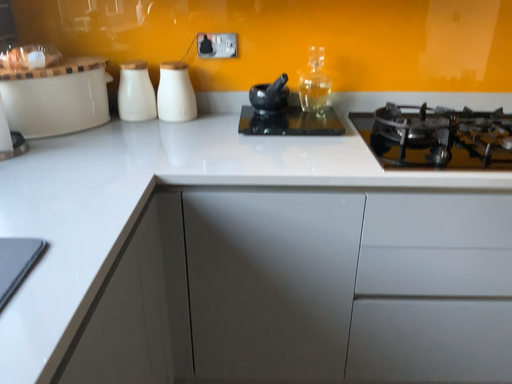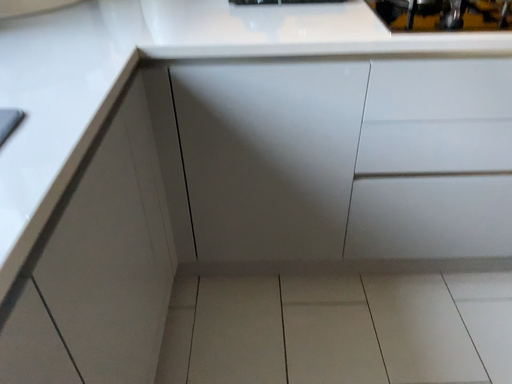
Question: How did the camera likely rotate when shooting the video?

Choices:
 (A) rotated downward
 (B) rotated upward

Answer: (A)